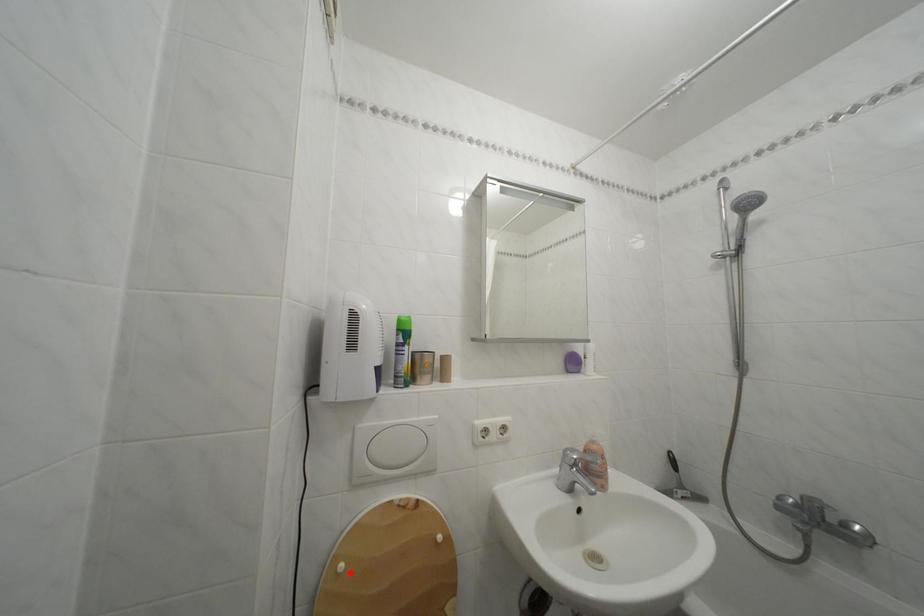
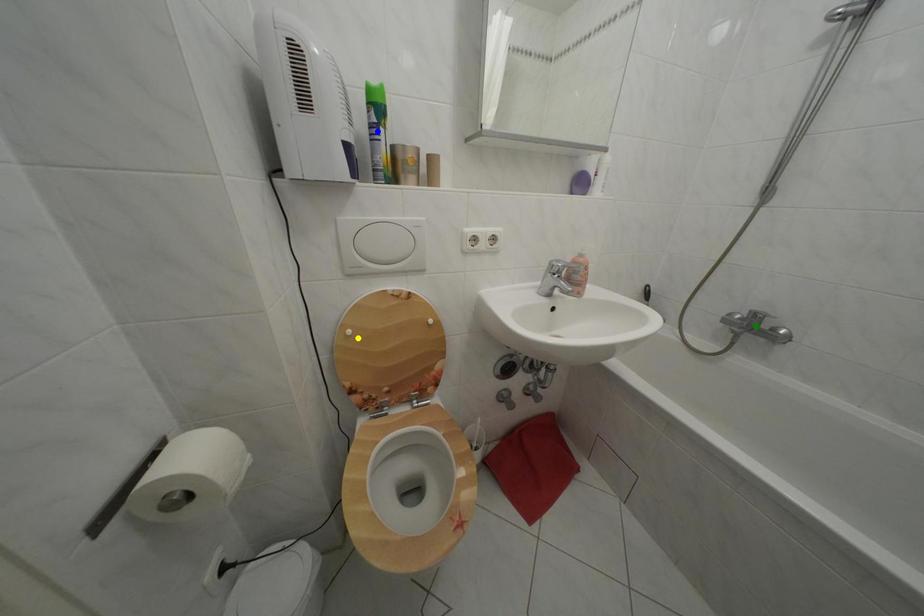
Question: I am providing you with two images of the same scene from different viewpoints. A red point is marked on the first image. You are given multiple points on the second image. Which mark in image 2 goes with the point in image 1?

Choices:
 (A) green point
 (B) blue point
 (C) yellow point

Answer: (C)